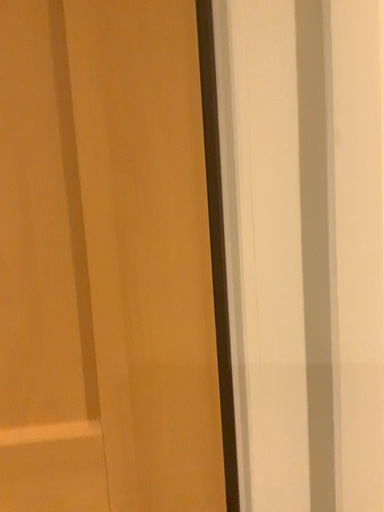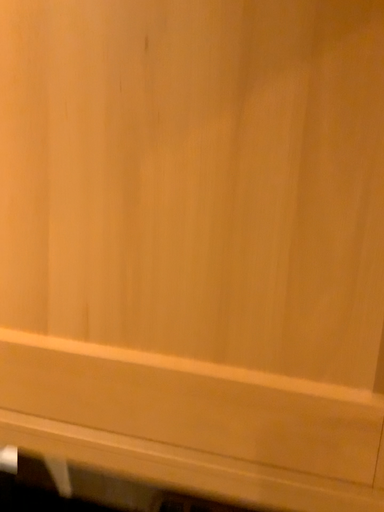
Question: Which way did the camera rotate in the video?

Choices:
 (A) rotated left
 (B) rotated right

Answer: (A)